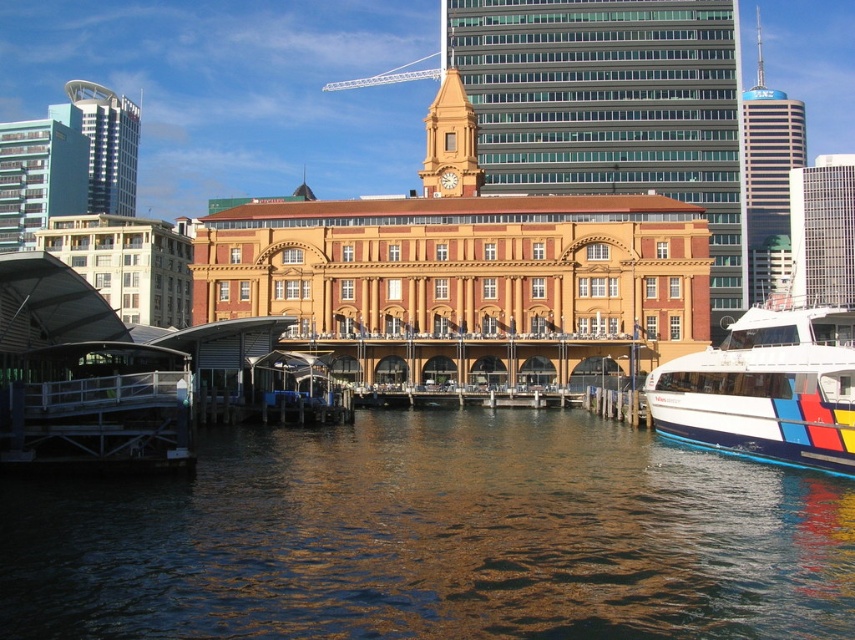
In the scene shown: Who is positioned more to the left, brown reflective water at center or white glossy boat at lower right?

From the viewer's perspective, brown reflective water at center appears more on the left side.

Does brown reflective water at center have a smaller size compared to white glossy boat at lower right?

Incorrect, brown reflective water at center is not smaller in size than white glossy boat at lower right.

Identify the location of brown reflective water at center. This screenshot has height=640, width=855. (433, 538).